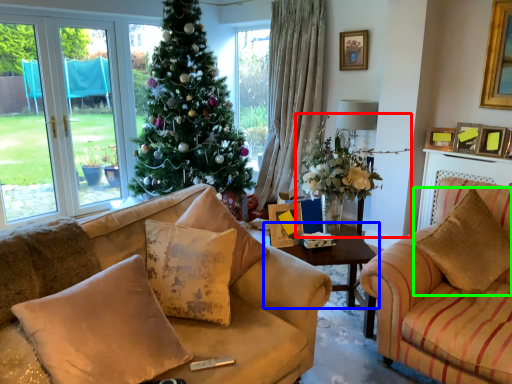
Question: Which object is the closest to the houseplant (highlighted by a red box)? Choose among these: table (highlighted by a blue box) or pillow (highlighted by a green box).

Choices:
 (A) table
 (B) pillow

Answer: (A)